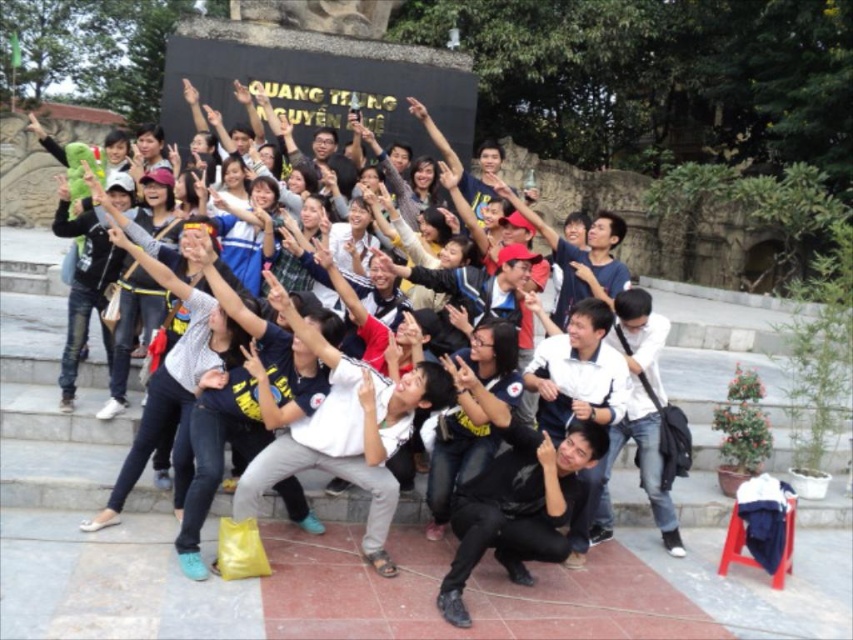
You are part of the group taking a photo in front of the monument. You notice two hands at the center of the image. Which hand is closer to you, the matte black hand at center or the smooth skin hand at center?

The matte black hand at center is closer to the viewer than the smooth skin hand at center.

You are a photographer trying to focus on the white matte shirt at center and the matte black hand at center. Which object should you adjust your focus to first if you want to capture both clearly in the photo?

The white matte shirt at center is in front of the matte black hand at center, so you should focus on the white matte shirt at center first to ensure both are in focus.

You are taking a photo of the group in front of the monument. The camera is set to focus on the center point. Will the matte black hand at center be in focus?

The matte black hand at center is positioned at point (546, 452), so it will be in focus since the camera is set to focus on the center point.